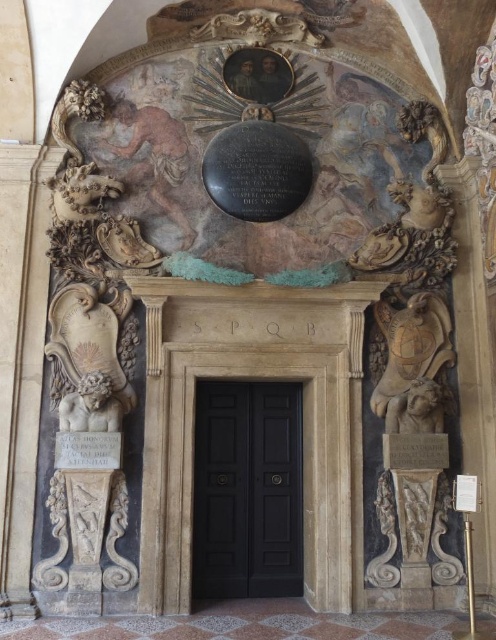
You are an art conservator assessing the entrance. You have a protective sheet that exactly matches the width of the white paper at lower right. Can you use this sheet to fully cover the white marble plaque at lower left without any overlap or gaps?

The white marble plaque at lower left is wider than the white paper at lower right. Since the protective sheet is only as wide as the white paper at lower right, it cannot fully cover the white marble plaque at lower left without leaving gaps on the sides.

You are an art student analyzing the entrance. You observe the white marble lion at lower left and the white marble plaque at lower left. Which object is positioned higher in the scene?

The white marble lion at lower left is positioned higher because it is above the white marble plaque at lower left.

You are an art conservator assessing the entrance. You notice the white marble plaque at lower left and the white paper at lower right. Which object is taller? Please refer to their positions and sizes in the scene.

The white marble plaque at lower left is much taller than the white paper at lower right.